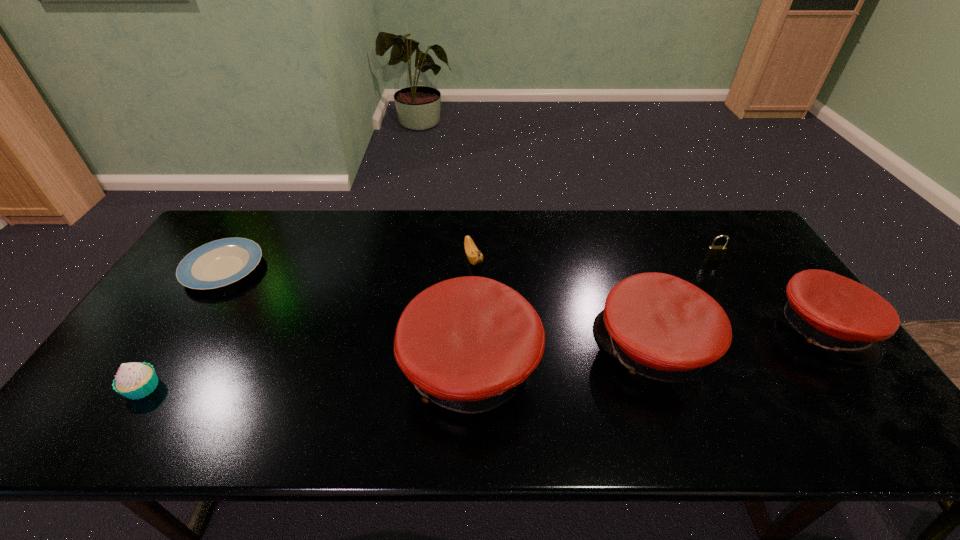
The height and width of the screenshot is (540, 960). I want to click on the leftmost cap, so click(x=467, y=344).

Where is `the second tallest object`? The height and width of the screenshot is (540, 960). the second tallest object is located at coordinates (659, 326).

This screenshot has width=960, height=540. Identify the location of the second tallest cap. (659, 326).

Find the location of a particular element. The height and width of the screenshot is (540, 960). the shortest cap is located at coordinates (847, 319).

The height and width of the screenshot is (540, 960). I want to click on the third tallest object, so click(847, 319).

The width and height of the screenshot is (960, 540). Find the location of `plate`. plate is located at coordinates (221, 262).

Find the location of a particular element. The height and width of the screenshot is (540, 960). banana is located at coordinates (475, 257).

This screenshot has width=960, height=540. I want to click on padlock, so click(x=713, y=252).

Where is `cupcake`? The width and height of the screenshot is (960, 540). cupcake is located at coordinates (135, 380).

What are the coordinates of `vacant space located at the front of the leftmost cap where the visor is located` in the screenshot? It's located at (305, 368).